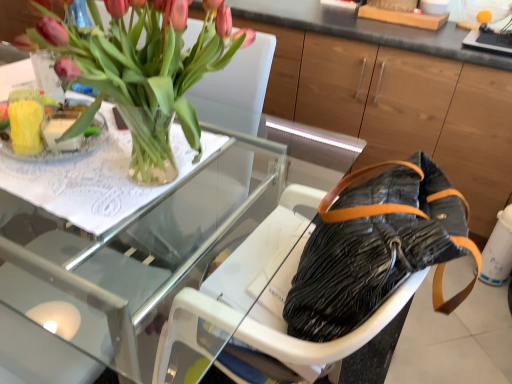
Question: Does pink matte tulips at upper left come in front of black matte bag at lower right?

Choices:
 (A) yes
 (B) no

Answer: (A)

Question: Is pink matte tulips at upper left bigger than black matte bag at lower right?

Choices:
 (A) no
 (B) yes

Answer: (A)

Question: From a real-world perspective, is pink matte tulips at upper left on black matte bag at lower right?

Choices:
 (A) yes
 (B) no

Answer: (A)

Question: Can you confirm if pink matte tulips at upper left is positioned to the left of black matte bag at lower right?

Choices:
 (A) no
 (B) yes

Answer: (A)

Question: Does pink matte tulips at upper left have a smaller size compared to black matte bag at lower right?

Choices:
 (A) yes
 (B) no

Answer: (A)

Question: Is pink matte tulips at upper left beside black matte bag at lower right?

Choices:
 (A) yes
 (B) no

Answer: (B)

Question: Are black matte bag at lower right and transparent glass table at upper left far apart?

Choices:
 (A) yes
 (B) no

Answer: (A)

Question: Is black matte bag at lower right closer to camera compared to transparent glass table at upper left?

Choices:
 (A) no
 (B) yes

Answer: (A)

Question: From the image's perspective, is black matte bag at lower right above transparent glass table at upper left?

Choices:
 (A) no
 (B) yes

Answer: (B)

Question: Is black matte bag at lower right to the left of transparent glass table at upper left from the viewer's perspective?

Choices:
 (A) yes
 (B) no

Answer: (A)

Question: Considering the relative sizes of black matte bag at lower right and transparent glass table at upper left in the image provided, is black matte bag at lower right shorter than transparent glass table at upper left?

Choices:
 (A) yes
 (B) no

Answer: (B)

Question: Is black matte bag at lower right thinner than transparent glass table at upper left?

Choices:
 (A) yes
 (B) no

Answer: (A)

Question: Is black fabric armchair at center wider than transparent glass table at upper left?

Choices:
 (A) no
 (B) yes

Answer: (A)